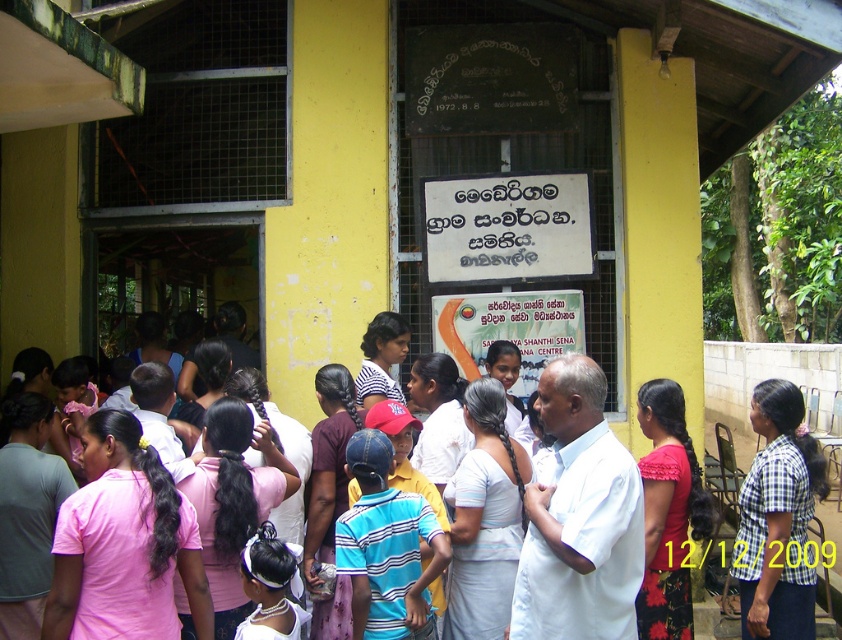
You are a photographer standing 2 meters away from the yellow building with a camera. You want to take a photo of the pink cotton shirt at center. Can you reach the shirt within your current distance without moving closer?

The pink cotton shirt at center and camera are 5.18 meters apart. Since you are already 2 meters away from the building, the shirt is 5.18 meters away from your camera. Therefore, you need to move closer to capture the shirt clearly.